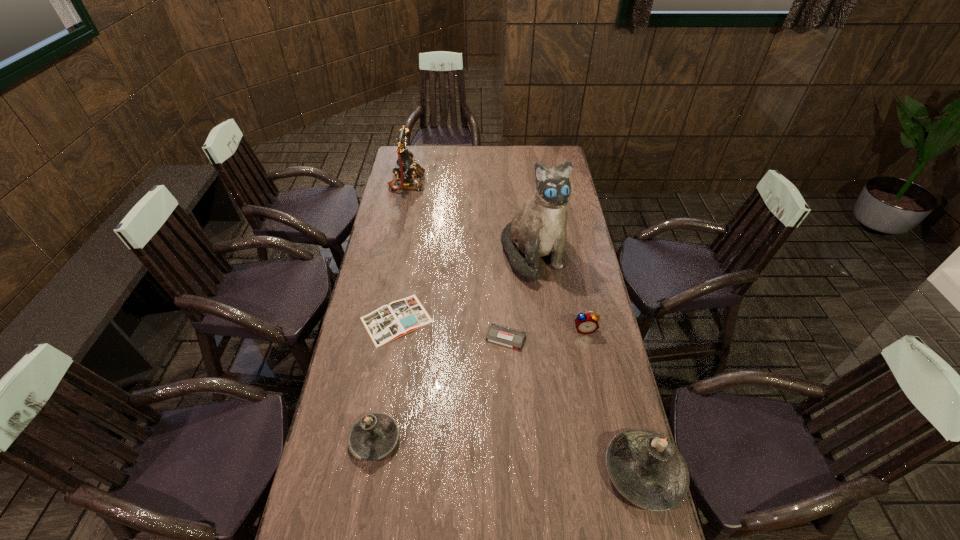
The width and height of the screenshot is (960, 540). I want to click on alarm clock, so click(x=586, y=323).

Identify the location of blank area located on the back of the left candle. This screenshot has width=960, height=540. (391, 346).

This screenshot has height=540, width=960. Identify the location of vacant space located on the left of the right candle. (587, 471).

Locate an element on the screen. The height and width of the screenshot is (540, 960). free space located on the front of the telephone, featuring the rotary dial is located at coordinates (504, 183).

Find the location of `free space located 0.280m at the face of the tallest object`. free space located 0.280m at the face of the tallest object is located at coordinates (543, 347).

At what (x,y) coordinates should I click in order to perform the action: click on blank area located on the front of the videotape. Please return your answer as a coordinate pair (x, y). Looking at the image, I should click on (507, 365).

Where is `free space located 0.360m on the right of the book`? free space located 0.360m on the right of the book is located at coordinates (531, 320).

Where is `free space located 0.110m on the front-facing side of the alarm clock`? This screenshot has width=960, height=540. free space located 0.110m on the front-facing side of the alarm clock is located at coordinates (591, 361).

Locate an element on the screen. object at the near edge is located at coordinates (646, 468).

At what (x,y) coordinates should I click in order to perform the action: click on candle present at the left edge. Please return your answer as a coordinate pair (x, y). The width and height of the screenshot is (960, 540). Looking at the image, I should click on (373, 436).